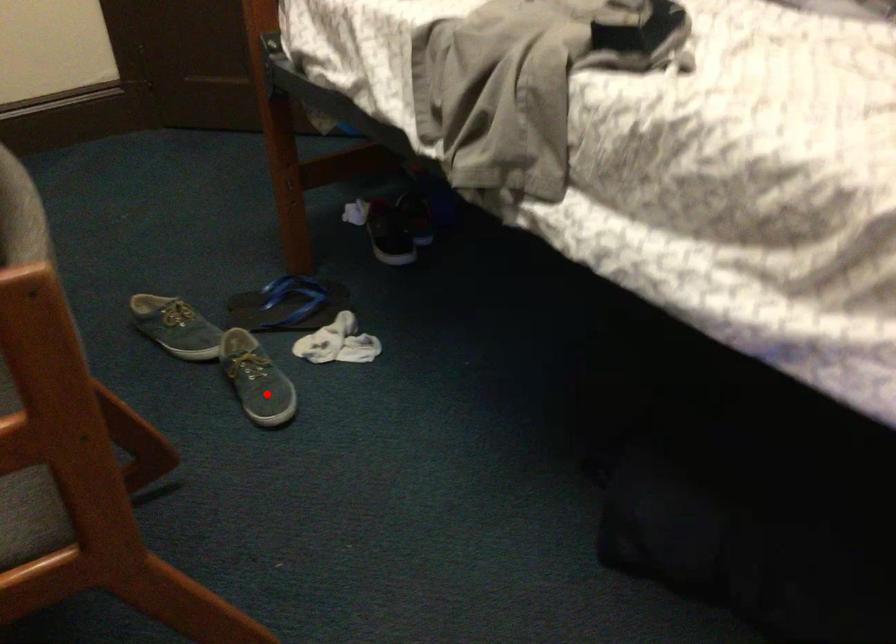
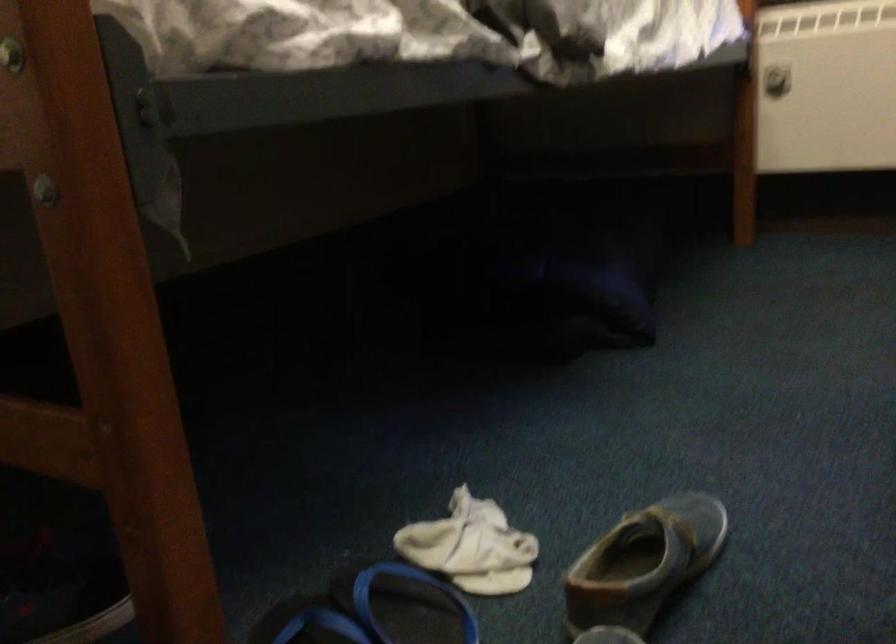
Question: A red point is marked in image1. In image2, is the corresponding 3D point closer to the camera or farther? Reply with the corresponding letter.

Choices:
 (A) The corresponding 3D point is closer.
 (B) The corresponding 3D point is farther.

Answer: (A)